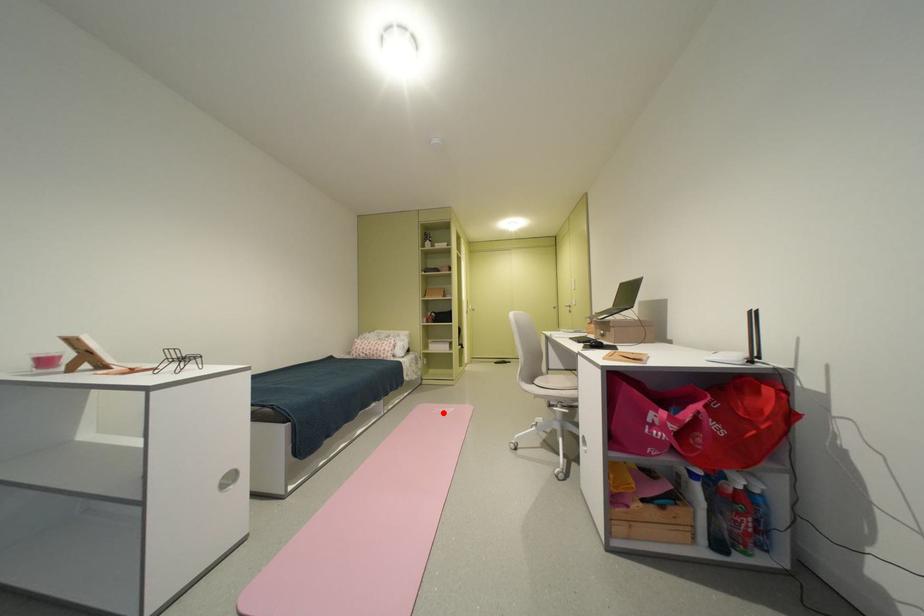
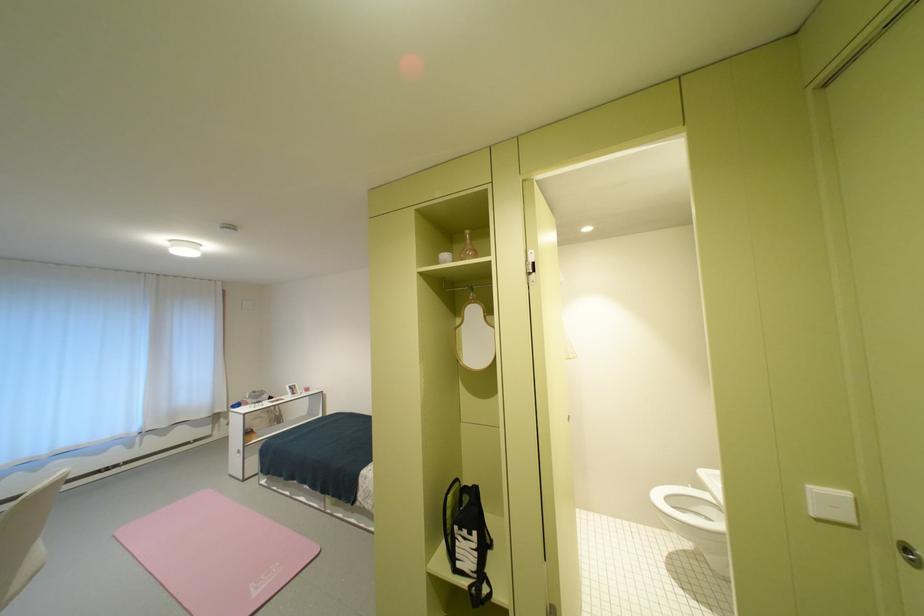
Question: A red point is marked in image1. In image2, is the corresponding 3D point closer to the camera or farther? Reply with the corresponding letter.

Choices:
 (A) The corresponding 3D point is closer.
 (B) The corresponding 3D point is farther.

Answer: (A)